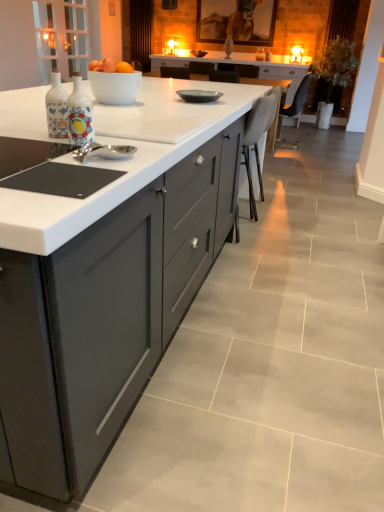
Question: Is white leather chair at center, which is the first chair from left to right, shorter than matte gray plate at center?

Choices:
 (A) no
 (B) yes

Answer: (A)

Question: Is white leather chair at center, which is the first chair from left to right, to the left of matte gray plate at center from the viewer's perspective?

Choices:
 (A) no
 (B) yes

Answer: (A)

Question: Considering the relative sizes of white leather chair at center, which appears as the 2th chair when viewed from the back, and matte gray plate at center in the image provided, is white leather chair at center, which appears as the 2th chair when viewed from the back, smaller than matte gray plate at center?

Choices:
 (A) no
 (B) yes

Answer: (A)

Question: Is white leather chair at center, the 1th chair in the front-to-back sequence, placed right next to matte gray plate at center?

Choices:
 (A) yes
 (B) no

Answer: (B)

Question: Would you say matte gray plate at center is part of white leather chair at center, the 1th chair in the front-to-back sequence,'s contents?

Choices:
 (A) no
 (B) yes

Answer: (A)

Question: Considering the positions of point pyautogui.click(x=14, y=287) and point pyautogui.click(x=243, y=141), is point pyautogui.click(x=14, y=287) closer or farther from the camera than point pyautogui.click(x=243, y=141)?

Choices:
 (A) farther
 (B) closer

Answer: (B)

Question: Relative to white leather chair at center, which appears as the 2th chair when viewed from the back, is matte gray cabinetry at center in front or behind?

Choices:
 (A) front
 (B) behind

Answer: (A)

Question: Looking at the image, does matte gray cabinetry at center seem bigger or smaller compared to white leather chair at center, the second chair viewed from the top?

Choices:
 (A) small
 (B) big

Answer: (B)

Question: Is matte gray cabinetry at center wider or thinner than white leather chair at center, the second chair viewed from the top?

Choices:
 (A) wide
 (B) thin

Answer: (A)

Question: In the image, is white glossy bowl at center on the left side or the right side of white leather chair at center, which is counted as the first chair, starting from the bottom?

Choices:
 (A) left
 (B) right

Answer: (A)

Question: Is point click(102, 87) closer or farther from the camera than point click(259, 185)?

Choices:
 (A) farther
 (B) closer

Answer: (B)

Question: From their relative heights in the image, would you say white glossy bowl at center is taller or shorter than white leather chair at center, which is counted as the first chair, starting from the bottom?

Choices:
 (A) short
 (B) tall

Answer: (A)

Question: Is white glossy bowl at center inside or outside of white leather chair at center, which appears as the 2th chair when viewed from the back?

Choices:
 (A) inside
 (B) outside

Answer: (B)

Question: Would you say white leather chair at center, the 2th chair from the right, is inside or outside white glossy bowl at center?

Choices:
 (A) outside
 (B) inside

Answer: (A)

Question: Visually, is white leather chair at center, which is counted as the first chair, starting from the bottom, positioned to the left or to the right of white glossy bowl at center?

Choices:
 (A) right
 (B) left

Answer: (A)